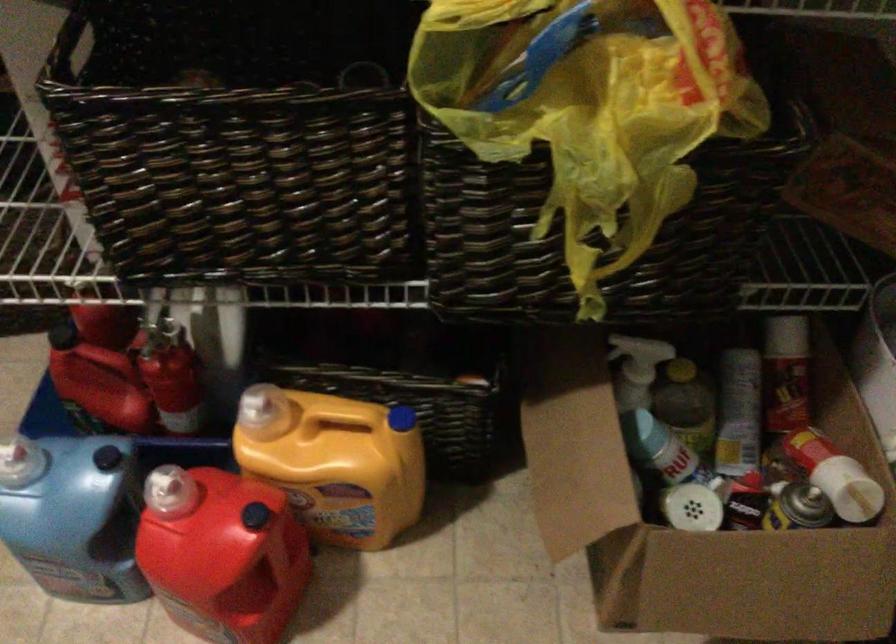
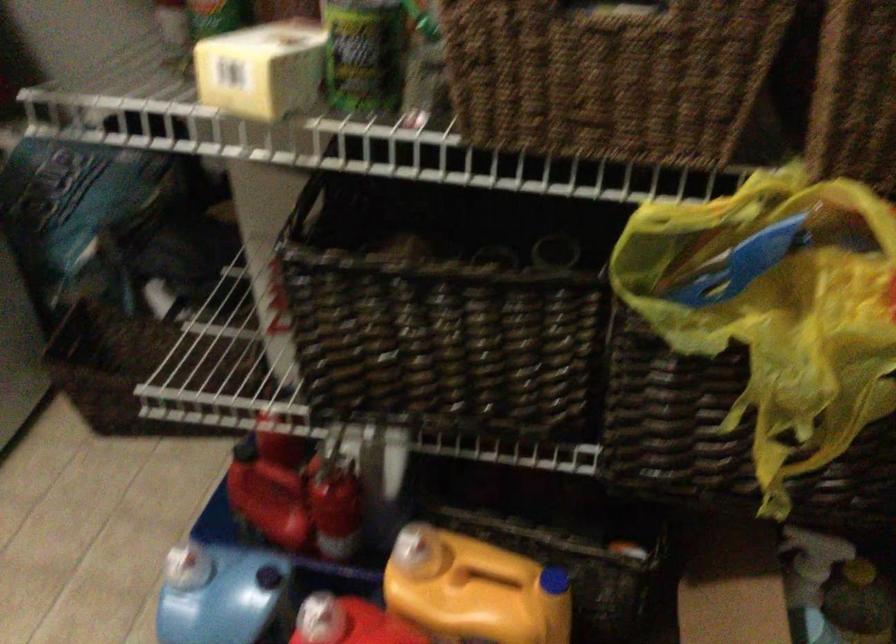
The point at (330, 439) is marked in the first image. Where is the corresponding point in the second image?

(474, 590)